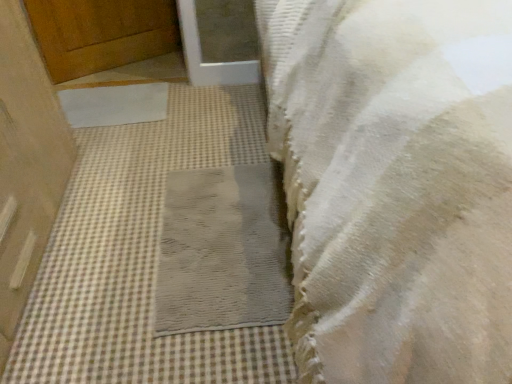
The width and height of the screenshot is (512, 384). In order to click on empty space that is ontop of gray textured mat at center, positioned as the first mat in front-to-back order (from a real-world perspective) in this screenshot , I will do `click(230, 225)`.